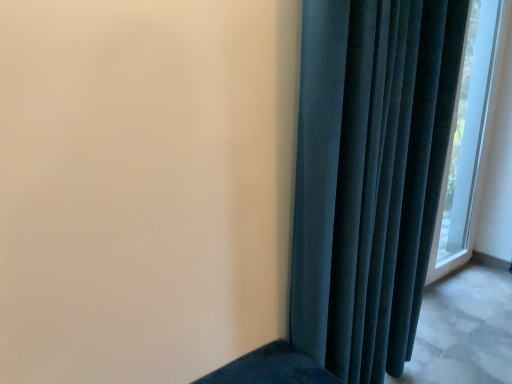
Question: Considering the positions of transparent glass window at right and velvet dark blue curtain at right in the image, is transparent glass window at right wider or thinner than velvet dark blue curtain at right?

Choices:
 (A) thin
 (B) wide

Answer: (A)

Question: From their relative heights in the image, would you say transparent glass window at right is taller or shorter than velvet dark blue curtain at right?

Choices:
 (A) short
 (B) tall

Answer: (B)

Question: Is point (474, 43) positioned closer to the camera than point (298, 256)?

Choices:
 (A) farther
 (B) closer

Answer: (A)

Question: From a real-world perspective, is velvet dark blue curtain at right physically located above or below transparent glass window at right?

Choices:
 (A) above
 (B) below

Answer: (B)

Question: In terms of width, does velvet dark blue curtain at right look wider or thinner when compared to transparent glass window at right?

Choices:
 (A) thin
 (B) wide

Answer: (B)

Question: Is velvet dark blue curtain at right in front of or behind transparent glass window at right in the image?

Choices:
 (A) front
 (B) behind

Answer: (A)

Question: From the image's perspective, is velvet dark blue curtain at right positioned above or below transparent glass window at right?

Choices:
 (A) above
 (B) below

Answer: (B)